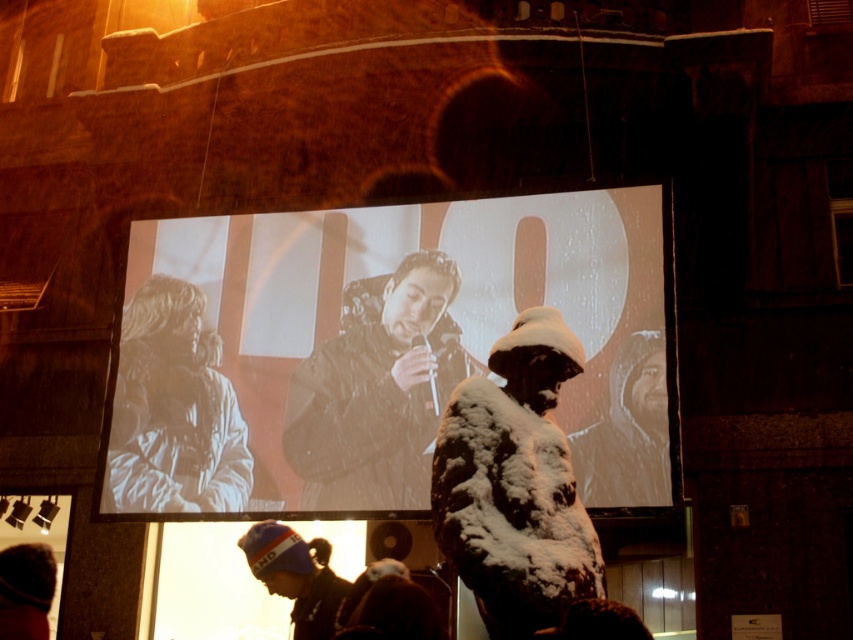
Question: Can you confirm if matte black jacket at center is wider than wet black jacket at center?

Choices:
 (A) yes
 (B) no

Answer: (A)

Question: Based on their relative distances, which object is nearer to the bearded man at center?

Choices:
 (A) dark blue knit cap at lower left
 (B) snow-covered statue at center
 (C) blue knit cap at lower left
 (D) white textured coat at left

Answer: (B)

Question: Can you confirm if white textured coat at left is positioned below blue knit cap at lower left?

Choices:
 (A) no
 (B) yes

Answer: (A)

Question: Which is farther from the snow-covered statue at center?

Choices:
 (A) white textured coat at left
 (B) blue knit cap at lower left

Answer: (A)

Question: Can you confirm if matte black jacket at center is positioned to the left of dark blue knit cap at lower left?

Choices:
 (A) no
 (B) yes

Answer: (A)

Question: Which object is the farthest from the wet black jacket at center?

Choices:
 (A) matte black jacket at center
 (B) snow-covered statue at center
 (C) dark blue knit cap at lower left

Answer: (C)